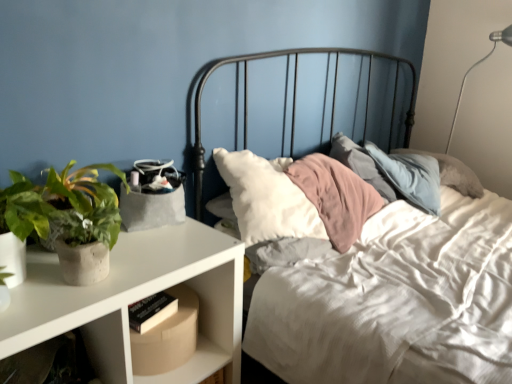
Locate an element on the screen. This screenshot has width=512, height=384. vacant area on top of white matte nightstand at left (from a real-world perspective) is located at coordinates (116, 254).